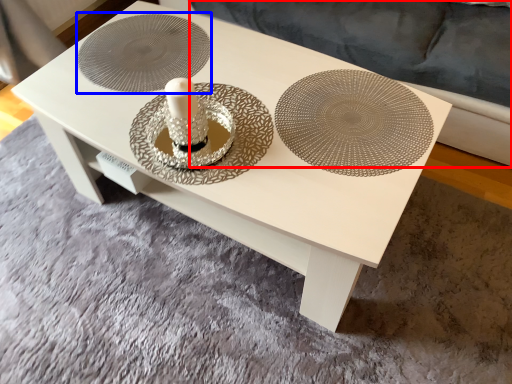
Question: Which point is closer to the camera, couch (highlighted by a red box) or circle (highlighted by a blue box)?

Choices:
 (A) couch
 (B) circle

Answer: (A)